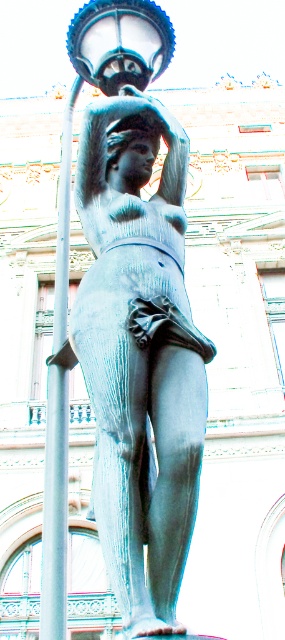
Question: Which of these objects is positioned closest to the bronze statue at center?

Choices:
 (A) silver metallic pole at left
 (B) matte glass lamp at upper center

Answer: (A)

Question: Is bronze statue at center below matte glass lamp at upper center?

Choices:
 (A) yes
 (B) no

Answer: (A)

Question: Which point is farther from the camera taking this photo?

Choices:
 (A) (143, 22)
 (B) (112, 445)

Answer: (A)

Question: Does silver metallic pole at left have a larger size compared to matte glass lamp at upper center?

Choices:
 (A) no
 (B) yes

Answer: (B)

Question: From the image, what is the correct spatial relationship of bronze statue at center in relation to matte glass lamp at upper center?

Choices:
 (A) above
 (B) below

Answer: (B)

Question: Which of the following is the closest to the observer?

Choices:
 (A) bronze statue at center
 (B) matte glass lamp at upper center

Answer: (A)